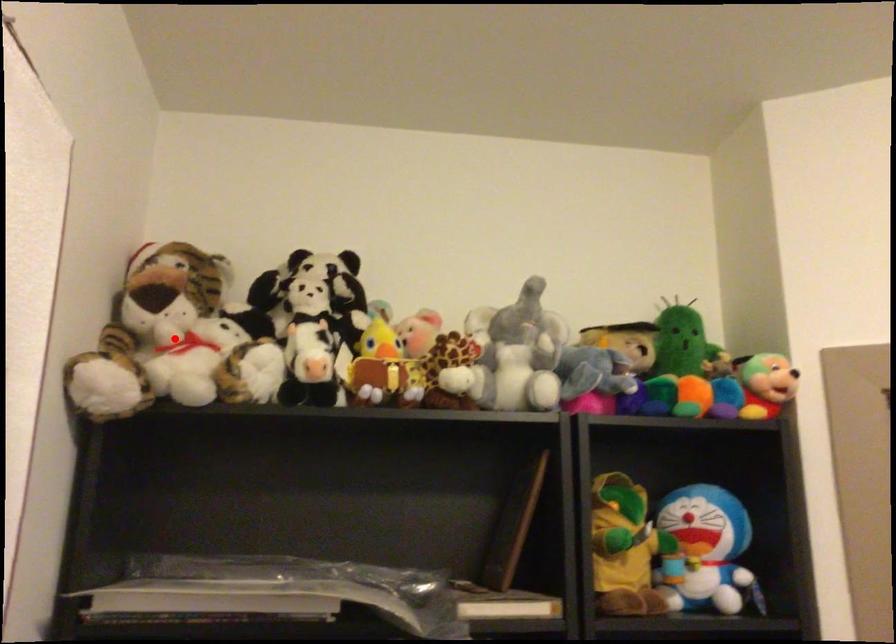
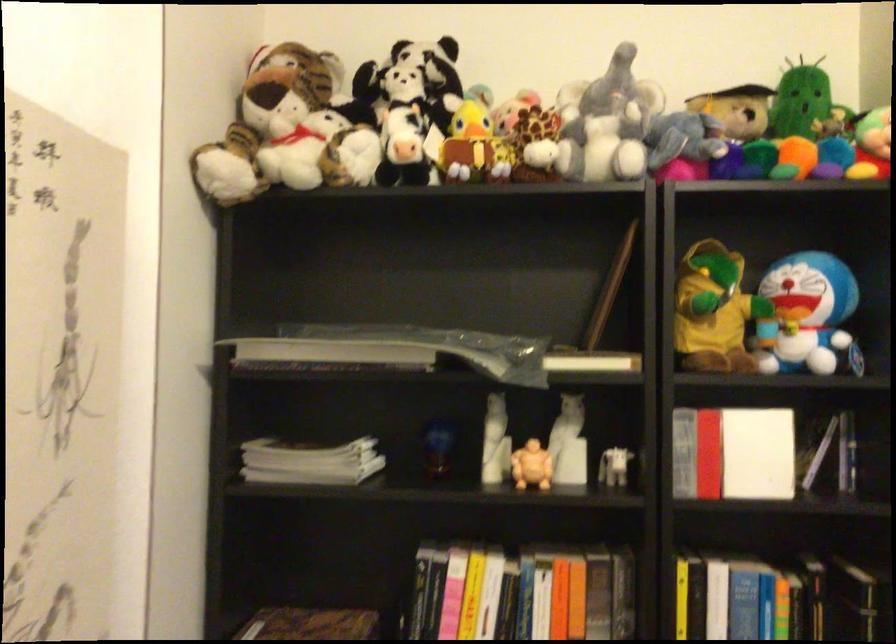
Question: I am providing you with two images of the same scene from different viewpoints. A red point is shown in image1. For the corresponding object point in image2, is it positioned nearer or farther from the camera?

Choices:
 (A) Nearer
 (B) Farther

Answer: (B)